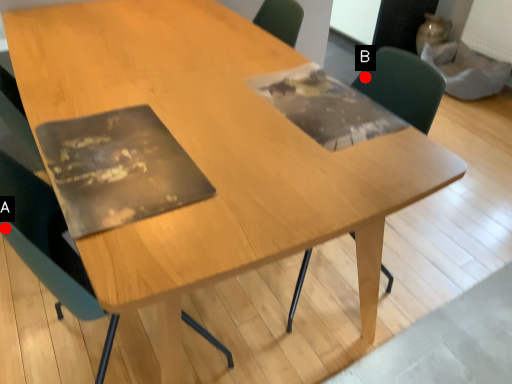
Question: Two points are circled on the image, labeled by A and B beside each circle. Which point appears farthest from the camera in this image?

Choices:
 (A) A is further
 (B) B is further

Answer: (B)